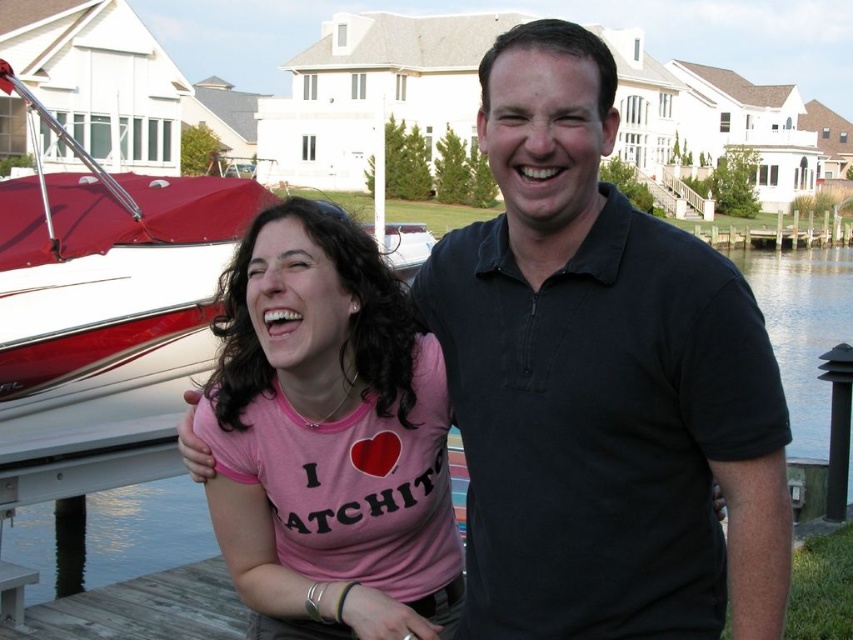
Does transparent water at dock lower appear under clear water at dock right?

Yes, transparent water at dock lower is below clear water at dock right.

Which is above, transparent water at dock lower or clear water at dock right?

Positioned higher is clear water at dock right.

Which is in front, point (18, 557) or point (775, 266)?

Point (18, 557)

This screenshot has height=640, width=853. I want to click on transparent water at dock lower, so click(109, 538).

The width and height of the screenshot is (853, 640). What do you see at coordinates (601, 384) in the screenshot?
I see `black cotton polo shirt at center` at bounding box center [601, 384].

Can you confirm if black cotton polo shirt at center is smaller than clear water at dock right?

Indeed, black cotton polo shirt at center has a smaller size compared to clear water at dock right.

The image size is (853, 640). I want to click on black cotton polo shirt at center, so click(601, 384).

Find the location of `black cotton polo shirt at center`. black cotton polo shirt at center is located at coordinates (601, 384).

Between black cotton polo shirt at center and pink cotton t-shirt at center, which one appears on the left side from the viewer's perspective?

pink cotton t-shirt at center

Between point (457, 413) and point (325, 221), which one is positioned behind?

The point (457, 413) is behind.

Locate an element on the screen. Image resolution: width=853 pixels, height=640 pixels. black cotton polo shirt at center is located at coordinates (601, 384).